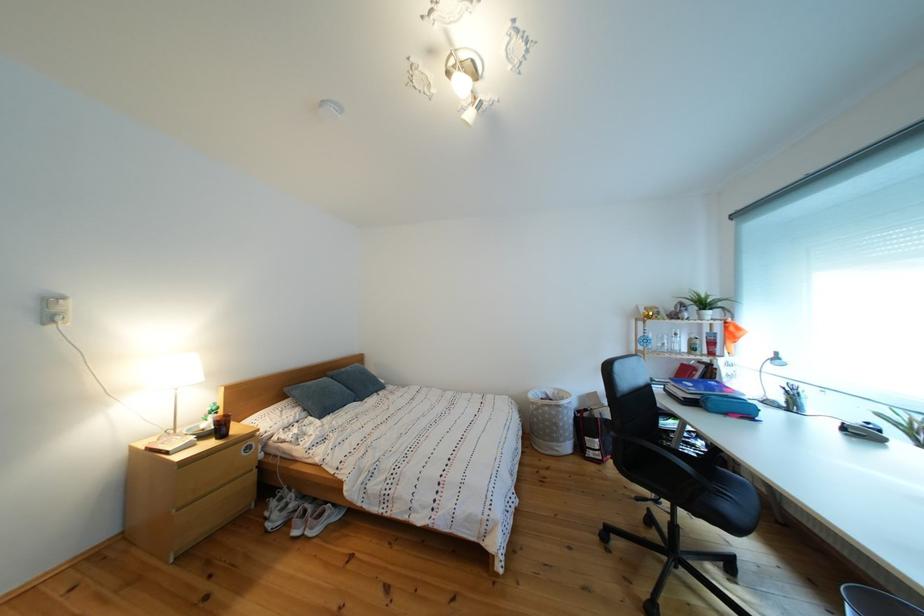
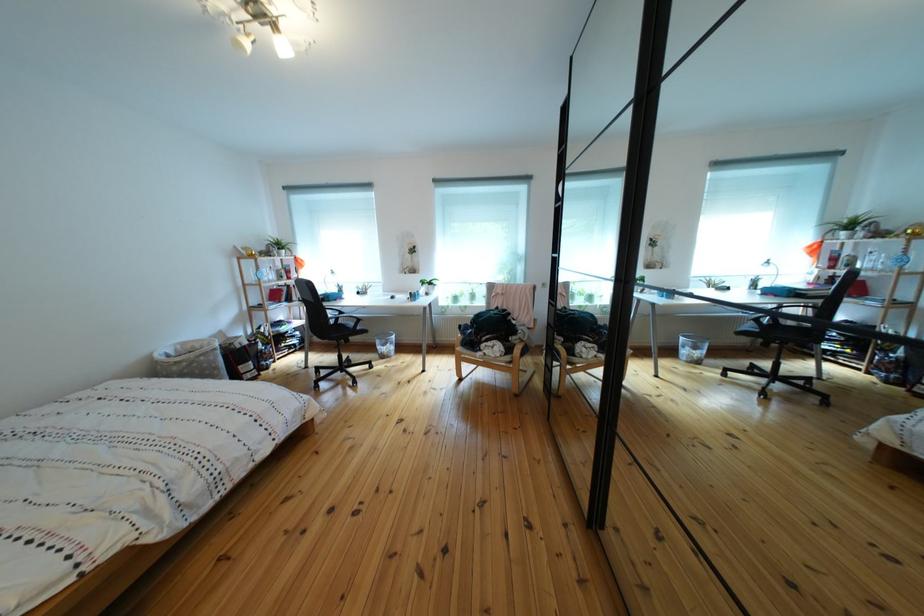
Where in the second image is the point corresponding to [565,400] from the first image?

(187, 355)